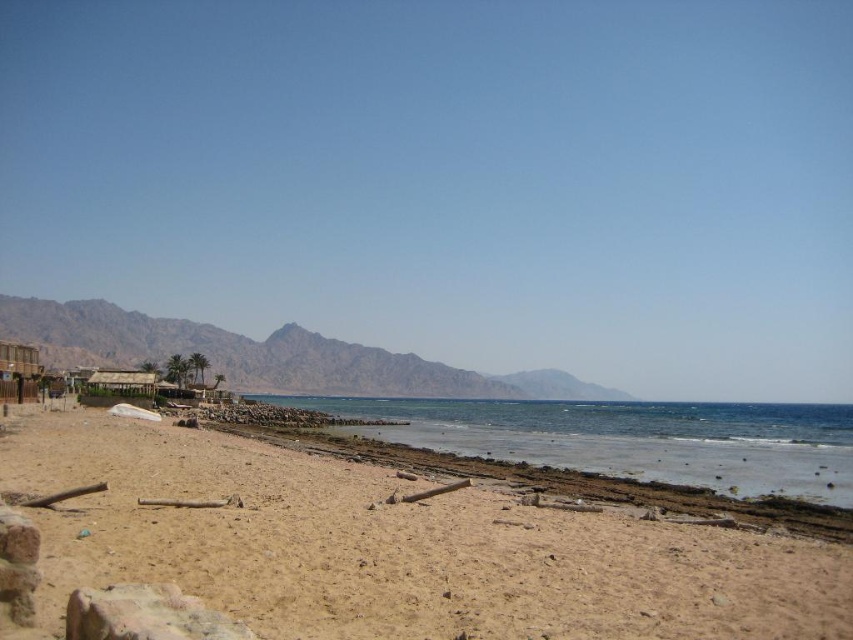
Looking at this image, you are standing on the beach and want to take a photo of both the clear blue water at lower center and the rugged brown mountain at center. Which object should you focus on first to ensure both are in sharp focus?

You should focus on the rugged brown mountain at center first because it is farther away than the clear blue water at lower center, allowing both to be in focus when using a camera with a fixed focal plane.

Based on the photo, you are standing on the rugged brown mountain at center and want to walk down to the brown sandy beach at lower center. Which direction should you head to reach the beach?

You should head to the right side since the brown sandy beach at lower center is positioned on the right side of rugged brown mountain at center.

You are standing on the beach and want to take a photo that includes both the clear blue water at lower center and the rugged brown mountain at center. Which object should you position closer to the edge of the frame to ensure both fit in the shot?

To ensure both the clear blue water at lower center and the rugged brown mountain at center fit in the shot, position the rugged brown mountain at center closer to the edge of the frame since the clear blue water at lower center might be wider than the rugged brown mountain at center.